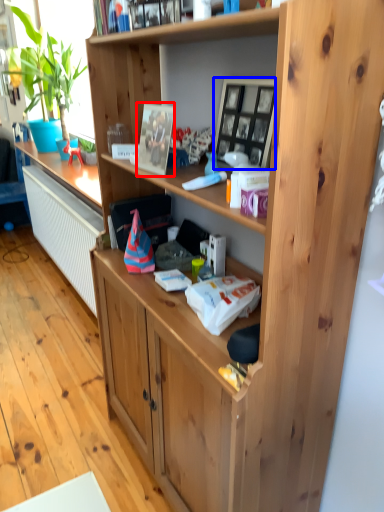
Question: Which object appears farthest to the camera in this image, picture frame (highlighted by a red box) or picture frame (highlighted by a blue box)?

Choices:
 (A) picture frame
 (B) picture frame

Answer: (A)